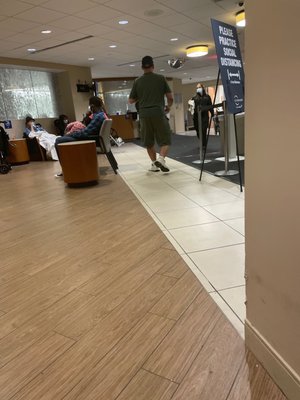
You are a GUI agent. You are given a task and a screenshot of the screen. Output one action in this format:
    pyautogui.click(x=<x>, y=<y>)
    Task: Click on the back of chair
    The width and height of the screenshot is (300, 400).
    Given the screenshot: What is the action you would take?
    pyautogui.click(x=104, y=128)